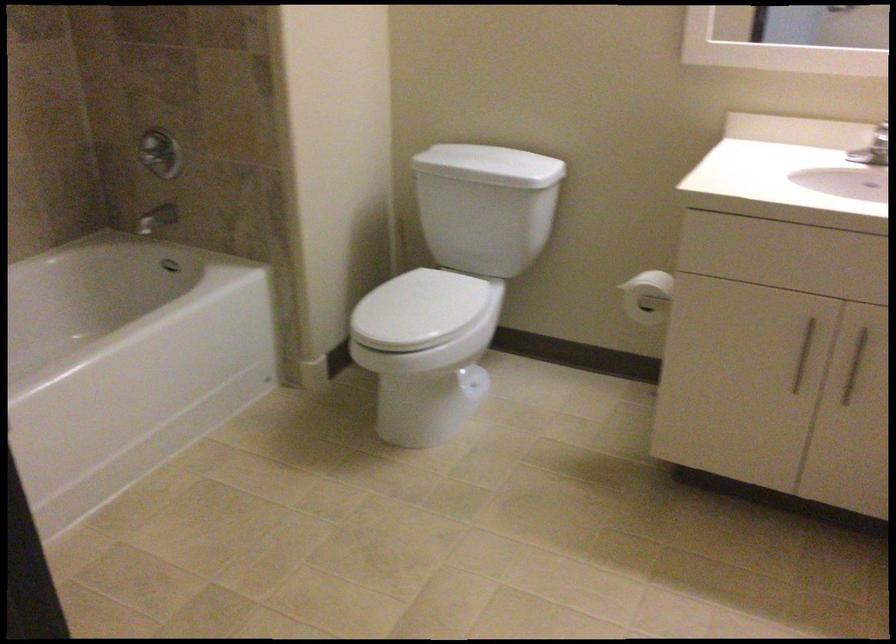
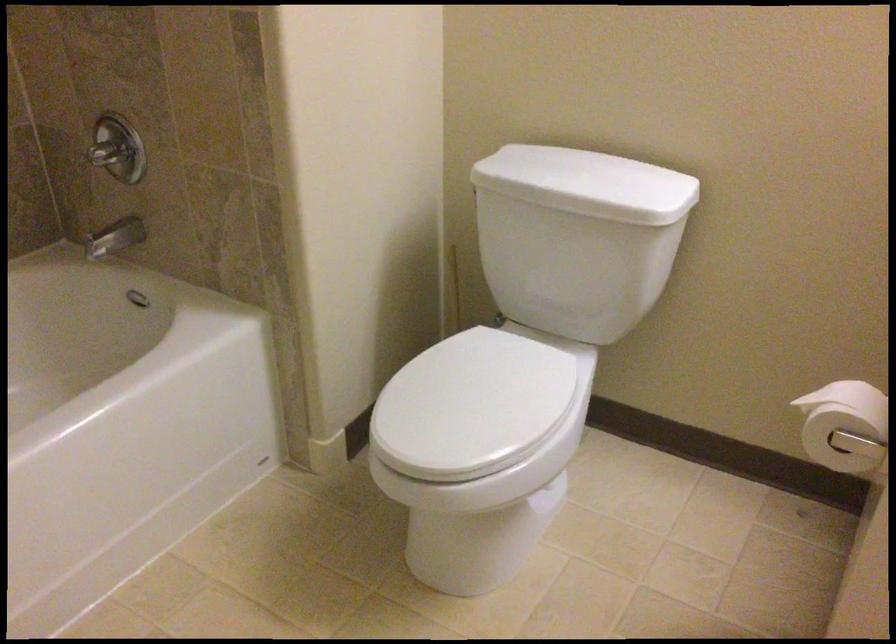
Question: In a continuous first-person perspective shot, in which direction is the camera moving?

Choices:
 (A) Left
 (B) Right
 (C) Forward
 (D) Backward

Answer: (C)